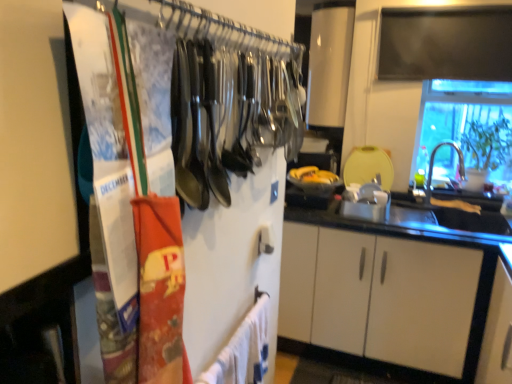
Image resolution: width=512 pixels, height=384 pixels. I want to click on white cotton bath towel at lower center, so click(x=244, y=350).

In order to face white cotton bath towel at lower center, should I rotate leftwards or rightwards?

Rotate your view left by about 0.026°.

This screenshot has height=384, width=512. I want to click on transparent glass window at upper right, so click(466, 130).

What is the approximate height of yellow matte banana at center?

It is 2.20 inches.

Measure the distance between silver metallic faucet at right and camera.

They are 8.64 feet apart.

Image resolution: width=512 pixels, height=384 pixels. What do you see at coordinates (185, 172) in the screenshot?
I see `metallic silver utensils at upper left` at bounding box center [185, 172].

Image resolution: width=512 pixels, height=384 pixels. I want to click on white cotton bath towel at lower center, so click(244, 350).

Would you say transparent glass window at upper right is to the left or to the right of metallic silver utensils at upper left in the picture?

Based on their positions, transparent glass window at upper right is located to the right of metallic silver utensils at upper left.

Is metallic silver utensils at upper left surrounded by transparent glass window at upper right?

That's incorrect, metallic silver utensils at upper left is not inside transparent glass window at upper right.

Is transparent glass window at upper right oriented away from metallic silver utensils at upper left?

No, transparent glass window at upper right's orientation is not away from metallic silver utensils at upper left.

Considering the relative sizes of transparent glass window at upper right and metallic silver utensils at upper left in the image provided, is transparent glass window at upper right smaller than metallic silver utensils at upper left?

Actually, transparent glass window at upper right might be larger than metallic silver utensils at upper left.

Who is taller, transparent glass window at upper right or yellow matte banana at center?

transparent glass window at upper right.

This screenshot has width=512, height=384. Identify the location of window that appears on the right of yellow matte banana at center. (466, 130).

Based on their positions, is transparent glass window at upper right located to the left or right of yellow matte banana at center?

From the image, it's evident that transparent glass window at upper right is to the right of yellow matte banana at center.

From a real-world perspective, is transparent glass window at upper right physically below yellow matte banana at center?

No.

You are a GUI agent. You are given a task and a screenshot of the screen. Output one action in this format:
    pyautogui.click(x=<x>, y=<y>)
    Task: Click on the food beneath the silver metallic faucet at right (from a real-world perspective)
    The width and height of the screenshot is (512, 384).
    Given the screenshot: What is the action you would take?
    pyautogui.click(x=313, y=175)

From the image's perspective, is silver metallic faucet at right located beneath yellow matte banana at center?

Correct, silver metallic faucet at right appears lower than yellow matte banana at center in the image.

Considering the relative positions of silver metallic faucet at right and yellow matte banana at center in the image provided, is silver metallic faucet at right to the left of yellow matte banana at center from the viewer's perspective?

No.

From a real-world perspective, which is physically above, silver metallic faucet at right or yellow matte banana at center?

silver metallic faucet at right is physically above.

Who is taller, white cotton bath towel at lower center or silver metallic faucet at right?

silver metallic faucet at right is taller.

From the picture: Could you tell me if white cotton bath towel at lower center is turned towards silver metallic faucet at right?

No, white cotton bath towel at lower center does not turn towards silver metallic faucet at right.

Is point (234, 380) less distant than point (452, 142)?

Yes, it is in front of point (452, 142).

Based on their positions, is white cotton bath towel at lower center located to the left or right of silver metallic faucet at right?

white cotton bath towel at lower center is to the left of silver metallic faucet at right.

The image size is (512, 384). I want to click on faucet on the left of transparent glass window at upper right, so click(433, 164).

Is transparent glass window at upper right oriented towards silver metallic faucet at right?

Yes, transparent glass window at upper right is oriented towards silver metallic faucet at right.

Considering the positions of objects transparent glass window at upper right and silver metallic faucet at right in the image provided, who is more to the right, transparent glass window at upper right or silver metallic faucet at right?

From the viewer's perspective, transparent glass window at upper right appears more on the right side.

Is point (266, 138) less distant than point (306, 181)?

Yes, it is in front of point (306, 181).

Based on their positions, is metallic silver utensils at upper left located to the left or right of yellow matte banana at center?

Based on their positions, metallic silver utensils at upper left is located to the left of yellow matte banana at center.

Is yellow matte banana at center inside or outside of metallic silver utensils at upper left?

yellow matte banana at center is not enclosed by metallic silver utensils at upper left.

From the image's perspective, between yellow matte banana at center and metallic silver utensils at upper left, which one is located above?

From the image's view, metallic silver utensils at upper left is above.

Considering the sizes of yellow matte banana at center and metallic silver utensils at upper left in the image, is yellow matte banana at center taller or shorter than metallic silver utensils at upper left?

In the image, yellow matte banana at center appears to be shorter than metallic silver utensils at upper left.

The image size is (512, 384). I want to click on closet above the transparent glass window at upper right (from a real-world perspective), so click(x=185, y=172).

This screenshot has width=512, height=384. I want to click on food below the transparent glass window at upper right (from a real-world perspective), so click(313, 175).

Looking at the image, which one is located closer to metallic silver utensils at upper left, yellow matte banana at center or transparent glass window at upper right?

yellow matte banana at center lies closer to metallic silver utensils at upper left than the other object.

From the image, which object appears to be nearer to transparent glass window at upper right, white cotton bath towel at lower center or metallic silver utensils at upper left?

The object closer to transparent glass window at upper right is metallic silver utensils at upper left.

Looking at the image, which one is located closer to transparent glass window at upper right, yellow matte banana at center or silver metallic faucet at right?

silver metallic faucet at right lies closer to transparent glass window at upper right than the other object.

Which object lies further to the anchor point yellow matte banana at center, transparent glass window at upper right or white cotton bath towel at lower center?

Among the two, white cotton bath towel at lower center is located further to yellow matte banana at center.

From the image, which object appears to be farther from white cotton bath towel at lower center, metallic silver utensils at upper left or silver metallic faucet at right?

Based on the image, silver metallic faucet at right appears to be further to white cotton bath towel at lower center.

Estimate the real-world distances between objects in this image. Which object is further from metallic silver utensils at upper left, yellow matte banana at center or white cotton bath towel at lower center?

yellow matte banana at center is positioned further to the anchor metallic silver utensils at upper left.

Based on their spatial positions, is silver metallic faucet at right or yellow matte banana at center closer to metallic silver utensils at upper left?

Based on the image, yellow matte banana at center appears to be nearer to metallic silver utensils at upper left.

From the image, which object appears to be farther from metallic silver utensils at upper left, transparent glass window at upper right or white cotton bath towel at lower center?

Based on the image, transparent glass window at upper right appears to be further to metallic silver utensils at upper left.

Find the location of a particular element. window positioned between white cotton bath towel at lower center and yellow matte banana at center from near to far is located at coordinates (466, 130).

Find the location of `bath towel positioned between metallic silver utensils at upper left and transparent glass window at upper right from near to far`. bath towel positioned between metallic silver utensils at upper left and transparent glass window at upper right from near to far is located at coordinates (244, 350).

The width and height of the screenshot is (512, 384). Identify the location of window located between white cotton bath towel at lower center and silver metallic faucet at right in the depth direction. (466, 130).

Image resolution: width=512 pixels, height=384 pixels. I want to click on window positioned between metallic silver utensils at upper left and yellow matte banana at center from near to far, so click(x=466, y=130).